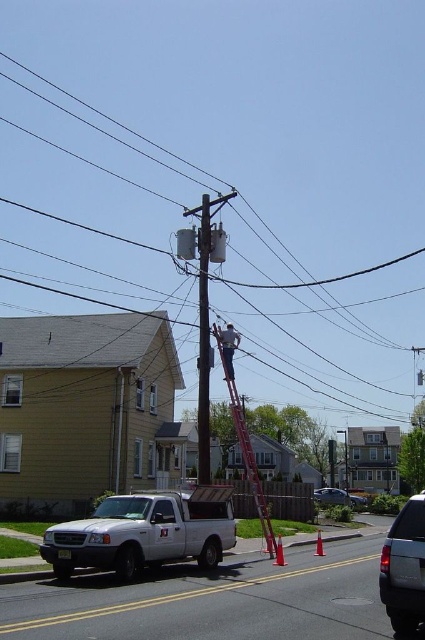
Who is more distant from viewer, (x=183, y=172) or (x=224, y=337)?

Point (x=183, y=172)

Is point (178, 202) behind point (226, 369)?

Yes, point (178, 202) is farther from viewer.

You are a GUI agent. You are given a task and a screenshot of the screen. Output one action in this format:
    pyautogui.click(x=<x>, y=<y>)
    Task: Click on the metallic pole at center
    
    Given the screenshot: What is the action you would take?
    pyautogui.click(x=322, y=278)

Which is more to the right, brown wooden telegraph pole at center or silver metallic sedan at center?

Positioned to the right is silver metallic sedan at center.

Is brown wooden telegraph pole at center wider than silver metallic sedan at center?

Incorrect, brown wooden telegraph pole at center's width does not surpass silver metallic sedan at center's.

Measure the distance between brown wooden telegraph pole at center and camera.

17.71 meters

I want to click on brown wooden telegraph pole at center, so click(204, 307).

Is smooth gray pole at center positioned before metallic silver ladder at center?

Yes, it is.

Is smooth gray pole at center to the left of metallic silver ladder at center from the viewer's perspective?

Yes, smooth gray pole at center is to the left of metallic silver ladder at center.

Does point (203, 410) lie behind point (223, 353)?

No, it is not.

This screenshot has height=640, width=425. Identify the location of smooth gray pole at center. (204, 342).